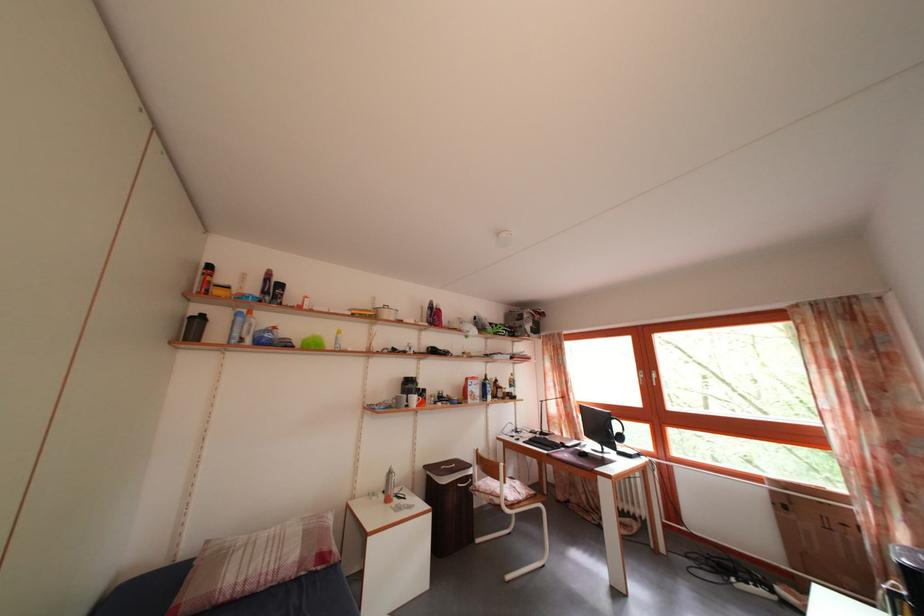
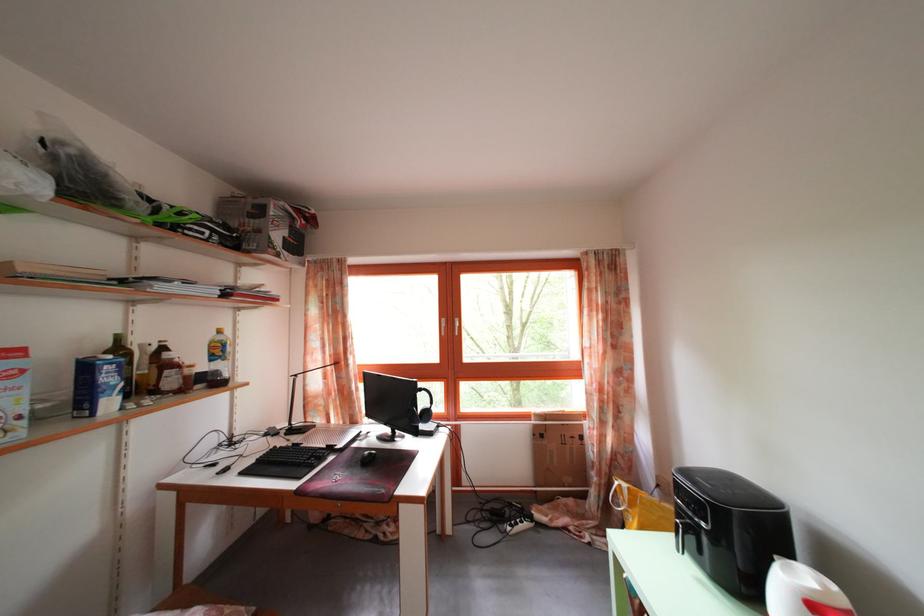
Locate, in the second image, the point that corresponds to point (519, 391) in the first image.

(225, 359)